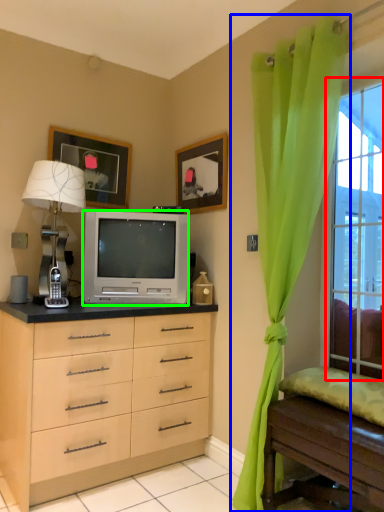
Question: Estimate the real-world distances between objects in this image. Which object is farther from window (highlighted by a red box), curtain (highlighted by a blue box) or television (highlighted by a green box)?

Choices:
 (A) curtain
 (B) television

Answer: (B)